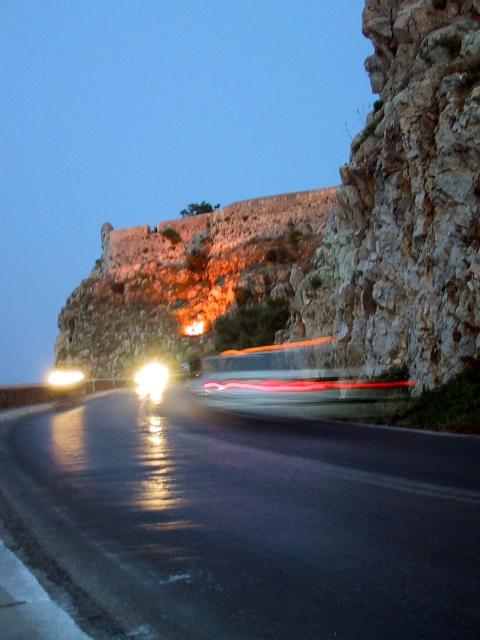
What do you see at coordinates (252, 522) in the screenshot? I see `black asphalt road at center` at bounding box center [252, 522].

Where is `black asphalt road at center`? The height and width of the screenshot is (640, 480). black asphalt road at center is located at coordinates (252, 522).

The width and height of the screenshot is (480, 640). What are the coordinates of `black asphalt road at center` in the screenshot? It's located at (252, 522).

From the picture: Which is below, black asphalt road at center or rocky cliff at right?

black asphalt road at center is below.

Describe the element at coordinates (252, 522) in the screenshot. The image size is (480, 640). I see `black asphalt road at center` at that location.

Does point (349, 481) come farther from viewer compared to point (474, 323)?

No, (349, 481) is in front of (474, 323).

Where is `black asphalt road at center`? Image resolution: width=480 pixels, height=640 pixels. black asphalt road at center is located at coordinates (252, 522).

From the picture: Is rocky cliff at right shorter than bright white plastic headlight at center?

No, rocky cliff at right is not shorter than bright white plastic headlight at center.

Is point (343, 317) in front of point (164, 369)?

Yes.

Find the location of a particular element. This screenshot has width=480, height=640. rocky cliff at right is located at coordinates (407, 202).